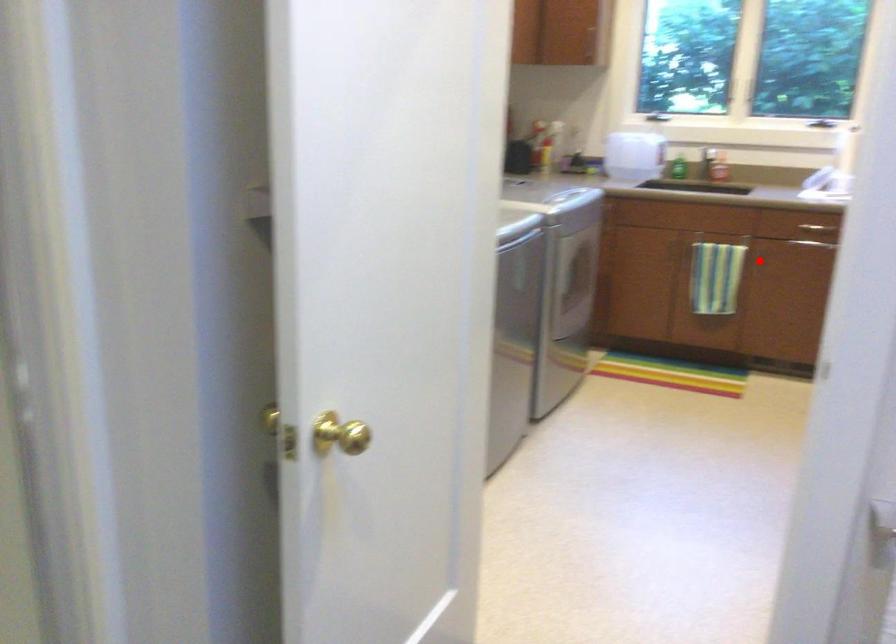
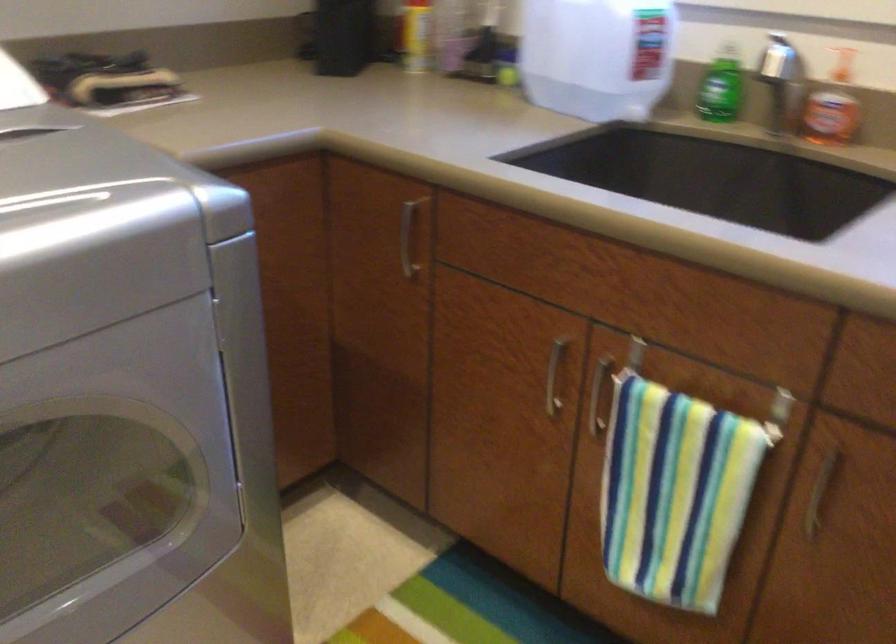
Where in the second image is the point corresponding to the highlighted location from the first image?

(819, 494)